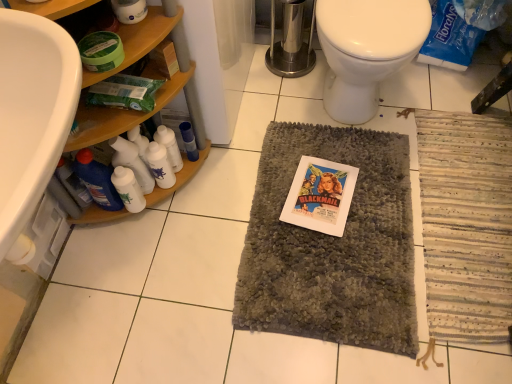
I want to click on vacant area that lies to the right of blue glossy bottle at lower left, which appears as the 1th bottle when viewed from the left, so click(x=174, y=217).